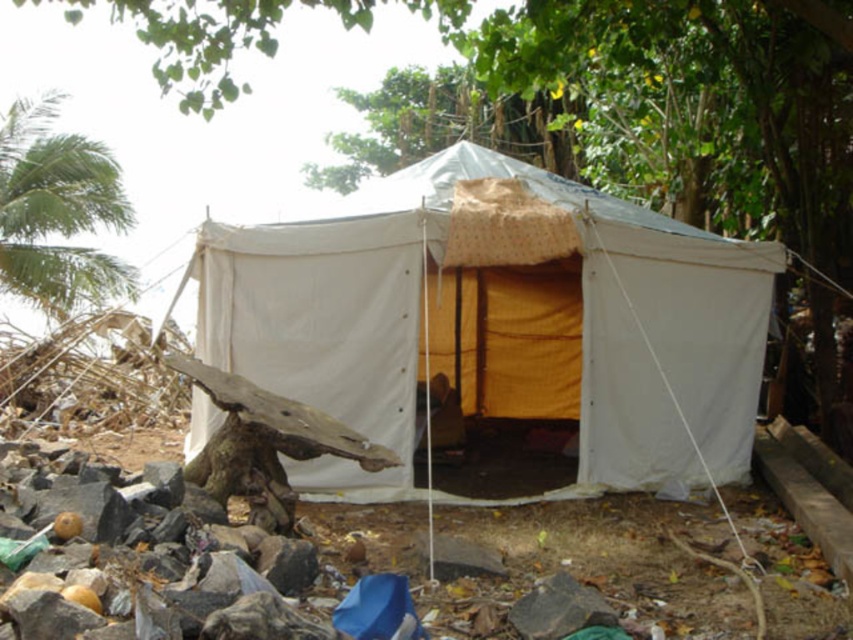
You are setting up a campsite and need to determine if there is enough space between the white canvas tent at center and the green leafy tree at left to set up a small fire pit. Can you confirm if there is sufficient space?

The white canvas tent at center occupies less space than the green leafy tree at left, so there is likely enough space between them for a small fire pit.